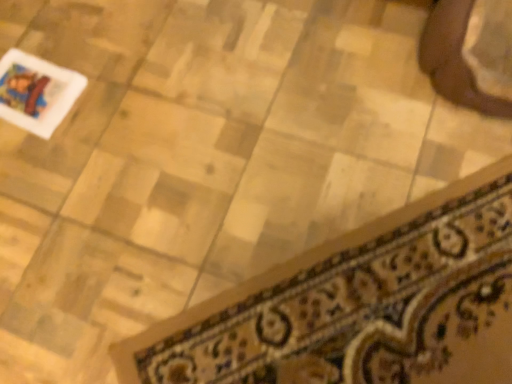
Question: Is patterned fabric doormat at lower right aimed at brown leather shoe at upper right?

Choices:
 (A) yes
 (B) no

Answer: (B)

Question: Is patterned fabric doormat at lower right bigger than brown leather shoe at upper right?

Choices:
 (A) no
 (B) yes

Answer: (A)

Question: From a real-world perspective, is patterned fabric doormat at lower right below brown leather shoe at upper right?

Choices:
 (A) no
 (B) yes

Answer: (B)

Question: From the image's perspective, would you say patterned fabric doormat at lower right is shown under brown leather shoe at upper right?

Choices:
 (A) yes
 (B) no

Answer: (A)

Question: From the image's perspective, is patterned fabric doormat at lower right on brown leather shoe at upper right?

Choices:
 (A) yes
 (B) no

Answer: (B)

Question: Is patterned fabric doormat at lower right located outside brown leather shoe at upper right?

Choices:
 (A) yes
 (B) no

Answer: (A)

Question: Can you confirm if brown leather shoe at upper right is wider than patterned fabric doormat at lower right?

Choices:
 (A) no
 (B) yes

Answer: (A)

Question: Could you tell me if brown leather shoe at upper right is turned towards patterned fabric doormat at lower right?

Choices:
 (A) no
 (B) yes

Answer: (B)

Question: Does brown leather shoe at upper right appear on the left side of patterned fabric doormat at lower right?

Choices:
 (A) yes
 (B) no

Answer: (B)

Question: Does brown leather shoe at upper right come in front of patterned fabric doormat at lower right?

Choices:
 (A) no
 (B) yes

Answer: (A)

Question: Is brown leather shoe at upper right outside patterned fabric doormat at lower right?

Choices:
 (A) yes
 (B) no

Answer: (A)

Question: Is brown leather shoe at upper right not near patterned fabric doormat at lower right?

Choices:
 (A) yes
 (B) no

Answer: (B)

Question: Looking at their shapes, would you say brown leather shoe at upper right is wider or thinner than patterned fabric doormat at lower right?

Choices:
 (A) thin
 (B) wide

Answer: (A)